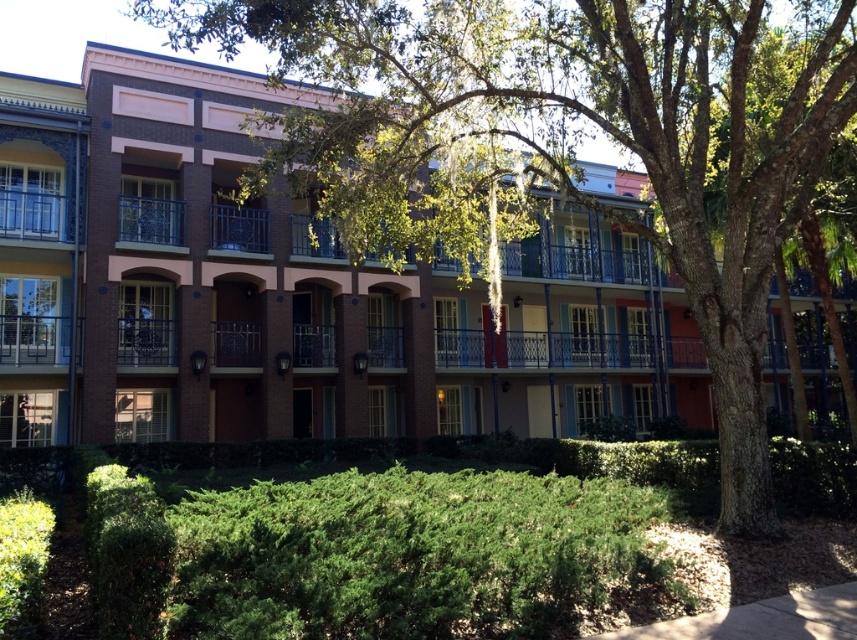
You are standing in the garden looking towards the building. There is a green leafy hedge at lower center and a metallic wrought iron balcony at center. Which object is closer to you?

The green leafy hedge at lower center is closer to you since it is in front of the metallic wrought iron balcony at center.

You are standing in front of the residential building and want to take a photo of both the point at coordinates (484,157) and the point at coordinates (243,614). Based on their positions, which point will appear closer to the camera in the photo?

Point (243,614) will appear closer to the camera in the photo because it is physically closer to the camera than point (484,157), which is further away.